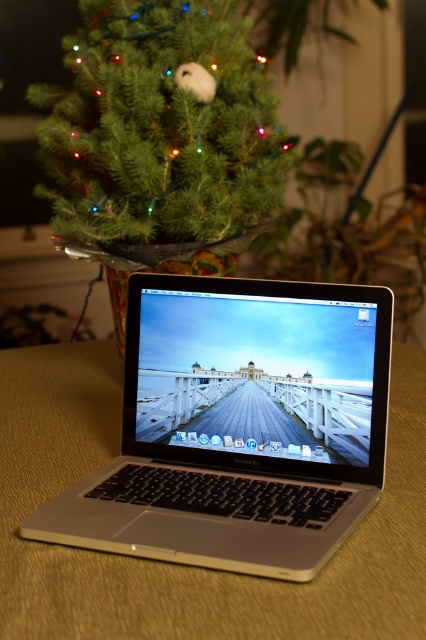
You are organizing a holiday photo shoot and need to position the silver metallic laptop at center and the green matte christmas tree at upper left in a way that maintains their current spatial relationship. If you want to ensure the laptop remains thinner than the tree, where should you place the camera relative to them?

The silver metallic laptop at center is thinner than the green matte christmas tree at upper left, so to maintain this relationship, position the camera so that the laptop is closer to the camera than the tree. This ensures the laptop appears thinner in the photo compared to the tree.

You are organizing a workspace and need to place both the silver metallic laptop at center and the green matte christmas tree at upper left. According to the image, which object is located to the right of the other?

The silver metallic laptop at center is positioned on the right side of green matte christmas tree at upper left.

You are a delivery robot with a package that needs to be placed between the silver metallic laptop at center and the green matte christmas tree at upper left. The package is 15 inches long. Can you fit it between them without moving either object?

The distance between the silver metallic laptop at center and the green matte christmas tree at upper left is 16.02 inches. Since the package is 15 inches long, it can fit between them as the space available is slightly larger than the package.